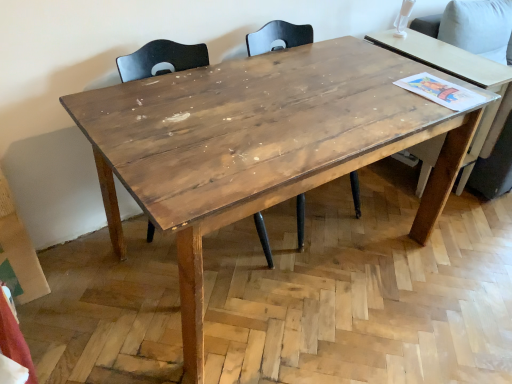
Question: Would you say wooden table at right is inside or outside wooden chair at center, which appears as the second chair when viewed from the right?

Choices:
 (A) outside
 (B) inside

Answer: (A)

Question: In terms of width, does wooden table at right look wider or thinner when compared to wooden chair at center, arranged as the 1th chair when viewed from the left?

Choices:
 (A) thin
 (B) wide

Answer: (B)

Question: Which object is positioned closest to the wooden chair at center, which is the first chair in right-to-left order?

Choices:
 (A) wooden chair at center, which appears as the second chair when viewed from the right
 (B) wooden table at right

Answer: (A)

Question: Which object is the farthest from the wooden chair at center, arranged as the 1th chair when viewed from the left?

Choices:
 (A) wooden chair at center, which is the first chair in right-to-left order
 (B) wooden table at right

Answer: (B)